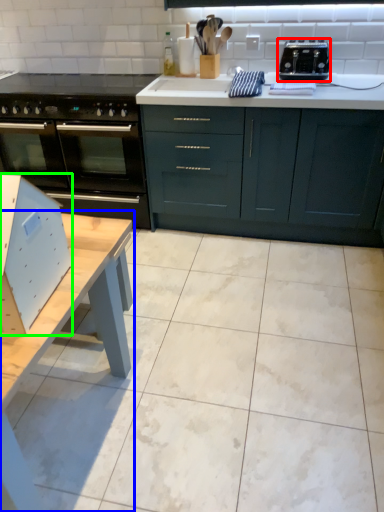
Question: Which object is positioned closest to toaster (highlighted by a red box)? Select from table (highlighted by a blue box) and appliance (highlighted by a green box).

Choices:
 (A) table
 (B) appliance

Answer: (A)